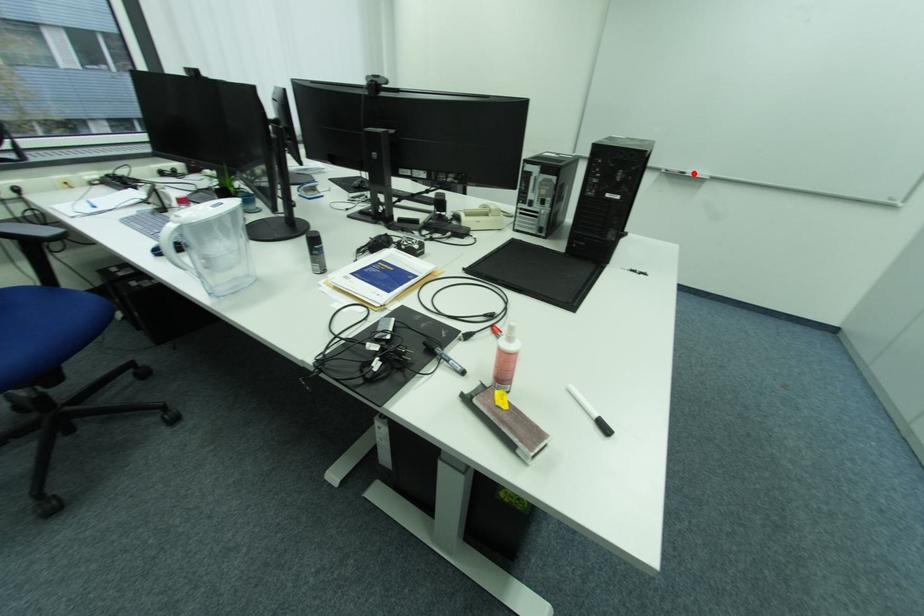
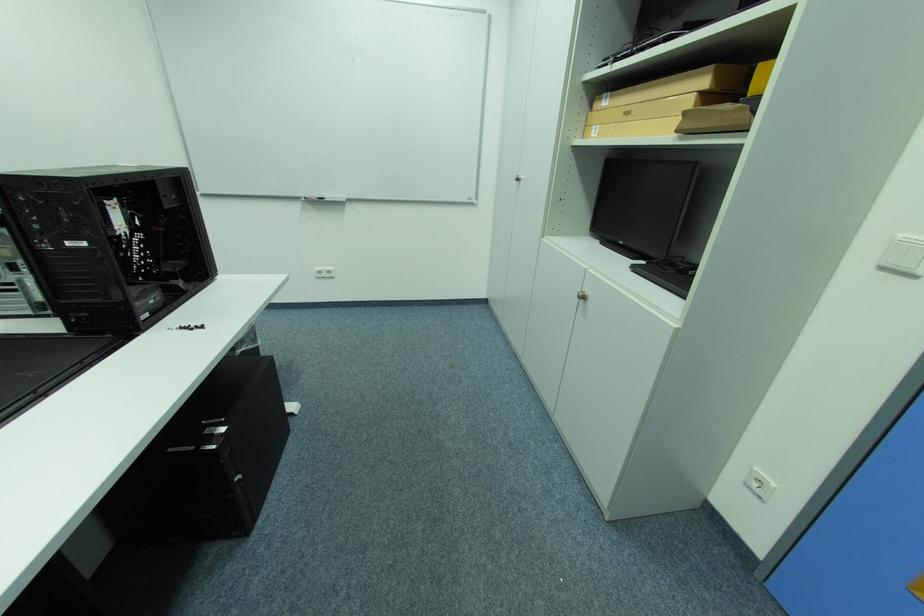
Question: I am providing you with two images of the same scene from different viewpoints. A red point is marked on the first image. At the location where the point appears in image 1, is it still visible in image 2?

Choices:
 (A) Yes
 (B) No

Answer: (A)